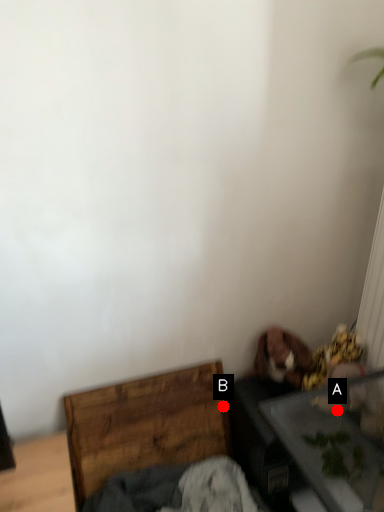
Question: Two points are circled on the image, labeled by A and B beside each circle. Which of the following is the closest to the observer?

Choices:
 (A) A is closer
 (B) B is closer

Answer: (A)